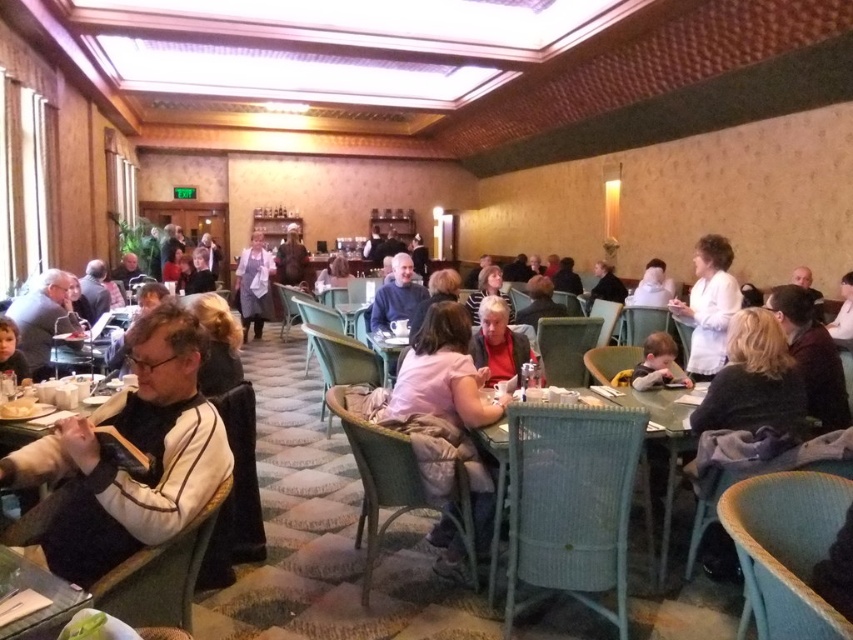
Question: Where is pink fabric shirt at center located in relation to matte red shirt at center in the image?

Choices:
 (A) below
 (B) above

Answer: (A)

Question: Which object is positioned closest to the white matte coat at upper right?

Choices:
 (A) matte red shirt at center
 (B) black fabric jacket at left
 (C) pink fabric shirt at center
 (D) teal wicker table at center

Answer: (D)

Question: Does pink fabric shirt at center have a smaller size compared to matte black jacket at left?

Choices:
 (A) yes
 (B) no

Answer: (A)

Question: Among these objects, which one is nearest to the camera?

Choices:
 (A) white apron at center
 (B) pink fabric shirt at center
 (C) matte red shirt at center
 (D) matte black jacket at left

Answer: (B)

Question: Does black fabric jacket at left have a smaller size compared to matte black jacket at left?

Choices:
 (A) yes
 (B) no

Answer: (A)

Question: Which point is closer to the camera taking this photo?

Choices:
 (A) (173, 440)
 (B) (245, 330)

Answer: (A)